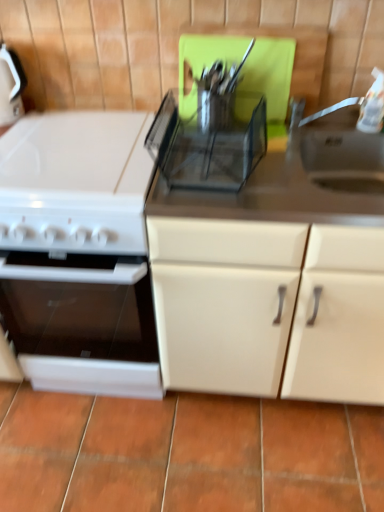
Question: Considering the positions of point (64, 176) and point (218, 135), is point (64, 176) closer or farther from the camera than point (218, 135)?

Choices:
 (A) closer
 (B) farther

Answer: (A)

Question: In terms of height, does white glossy oven at left look taller or shorter compared to transparent plastic utensil rack at center?

Choices:
 (A) short
 (B) tall

Answer: (B)

Question: Which of these objects is positioned closest to the terracotta tile at lower center?

Choices:
 (A) transparent plastic utensil rack at center
 (B) matte white cabinet at center
 (C) white glossy oven at left

Answer: (B)

Question: Which is farther from the matte white cabinet at center?

Choices:
 (A) terracotta tile at lower center
 (B) transparent plastic utensil rack at center
 (C) white glossy oven at left

Answer: (A)